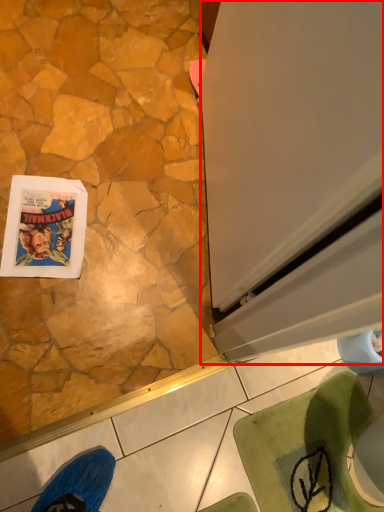
Question: From the image's perspective, what is the correct spatial relationship of screen door (annotated by the red box) in relation to comic book?

Choices:
 (A) above
 (B) below

Answer: (A)